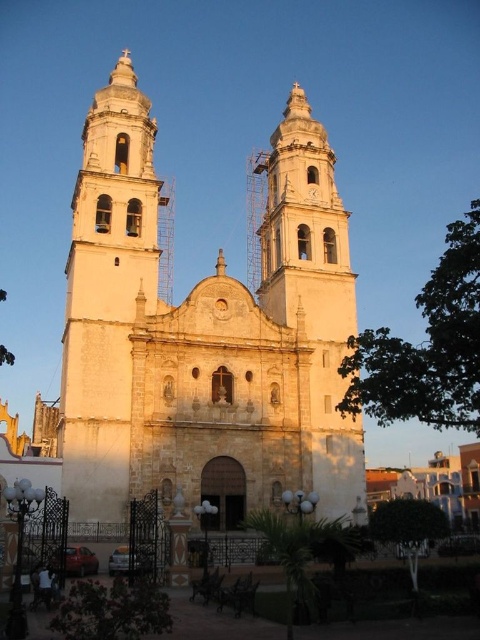
Question: Which of the following is the farthest from the observer?

Choices:
 (A) white stone church at center
 (B) white stone tower at left

Answer: (A)

Question: Is white stone church at center wider than white stone tower at left?

Choices:
 (A) yes
 (B) no

Answer: (A)

Question: Is white stone church at center bigger than white stone tower at left?

Choices:
 (A) yes
 (B) no

Answer: (A)

Question: Is white stone church at center thinner than white stone tower at left?

Choices:
 (A) yes
 (B) no

Answer: (B)

Question: Which point is closer to the camera?

Choices:
 (A) white stone church at center
 (B) white stone tower at left

Answer: (B)